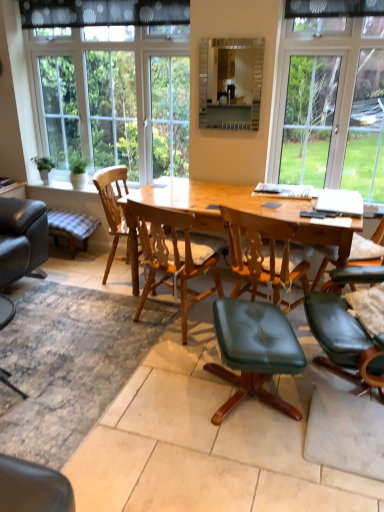
Question: Are green leafy plant at left and matte glass mirror at upper center making contact?

Choices:
 (A) yes
 (B) no

Answer: (B)

Question: Would you say green leafy plant at left is outside matte glass mirror at upper center?

Choices:
 (A) no
 (B) yes

Answer: (B)

Question: Is green leafy plant at left not near matte glass mirror at upper center?

Choices:
 (A) no
 (B) yes

Answer: (B)

Question: From a real-world perspective, does green leafy plant at left stand above matte glass mirror at upper center?

Choices:
 (A) yes
 (B) no

Answer: (B)

Question: Is green leafy plant at left smaller than matte glass mirror at upper center?

Choices:
 (A) no
 (B) yes

Answer: (B)

Question: Is green leafy plant at left at the right side of matte glass mirror at upper center?

Choices:
 (A) yes
 (B) no

Answer: (B)

Question: From a real-world perspective, does wooden chair at center, which is the 2th chair from front to back, stand above black plastic remote control at center?

Choices:
 (A) no
 (B) yes

Answer: (A)

Question: Is wooden chair at center, which is the 2th chair from front to back, shorter than black plastic remote control at center?

Choices:
 (A) yes
 (B) no

Answer: (B)

Question: Is black plastic remote control at center at the back of wooden chair at center, which is the 2th chair from front to back?

Choices:
 (A) yes
 (B) no

Answer: (B)

Question: From the image's perspective, is wooden chair at center, which is the second chair in back-to-front order, located above black plastic remote control at center?

Choices:
 (A) no
 (B) yes

Answer: (A)

Question: Can you confirm if wooden chair at center, which is the 2th chair from front to back, is bigger than black plastic remote control at center?

Choices:
 (A) yes
 (B) no

Answer: (A)

Question: Does wooden chair at center, which is the 2th chair from front to back, have a lesser width compared to black plastic remote control at center?

Choices:
 (A) yes
 (B) no

Answer: (B)

Question: Is plaid fabric stool at lower left facing away from black dotted fabric at upper center?

Choices:
 (A) no
 (B) yes

Answer: (A)